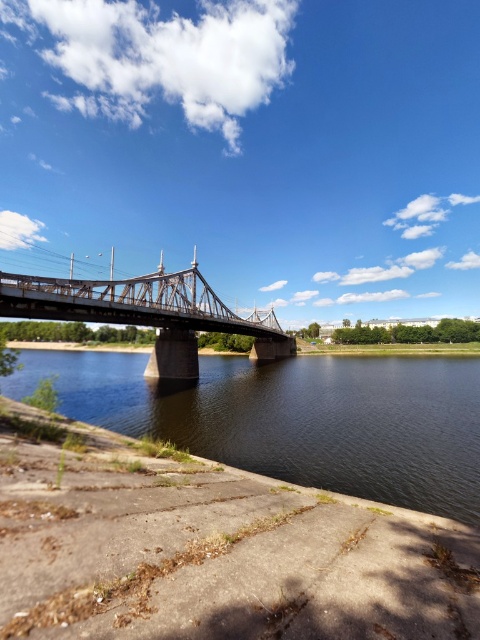
Question: Considering the relative positions of dark brown water at center and metallic bridge at center in the image provided, where is dark brown water at center located with respect to metallic bridge at center?

Choices:
 (A) below
 (B) above

Answer: (A)

Question: Is dark brown water at center positioned behind metallic bridge at center?

Choices:
 (A) yes
 (B) no

Answer: (B)

Question: Among these objects, which one is nearest to the camera?

Choices:
 (A) metallic bridge at center
 (B) dark brown water at center

Answer: (B)

Question: Is dark brown water at center above metallic bridge at center?

Choices:
 (A) no
 (B) yes

Answer: (A)